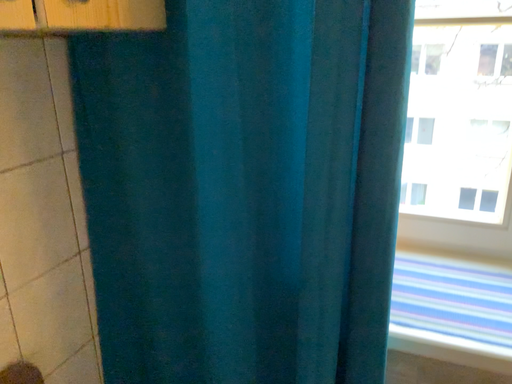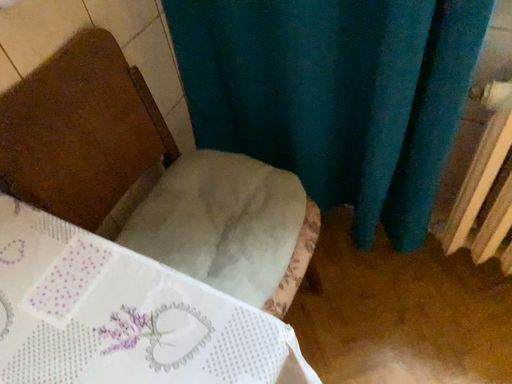
Question: How did the camera likely rotate when shooting the video?

Choices:
 (A) rotated downward
 (B) rotated upward

Answer: (A)